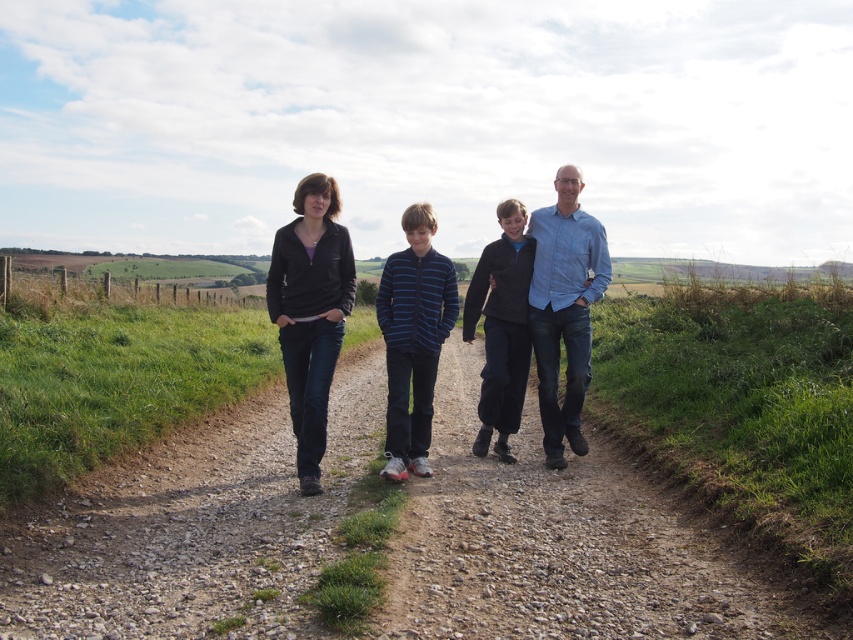
Which is above, blue striped sweater at center or dark blue fleece jacket at center?

dark blue fleece jacket at center is above.

Is point (426, 436) positioned before point (465, 326)?

Yes, point (426, 436) is closer to viewer.

Locate an element on the screen. The height and width of the screenshot is (640, 853). blue striped sweater at center is located at coordinates (413, 339).

The height and width of the screenshot is (640, 853). Describe the element at coordinates (413, 337) in the screenshot. I see `dark blue jeans at center` at that location.

Is dark blue jeans at center taller than dark blue fleece jacket at center?

No, dark blue jeans at center is not taller than dark blue fleece jacket at center.

The width and height of the screenshot is (853, 640). What are the coordinates of `dark blue jeans at center` in the screenshot? It's located at (413, 337).

I want to click on dark blue jeans at center, so click(x=413, y=337).

Which is in front, point (521, 342) or point (393, 472)?

Point (393, 472) is more forward.

Consider the image. Measure the distance between dark blue jeans at center and camera.

5.66 meters

What do you see at coordinates (413, 337) in the screenshot? The width and height of the screenshot is (853, 640). I see `dark blue jeans at center` at bounding box center [413, 337].

In order to click on dark blue jeans at center in this screenshot , I will do `click(413, 337)`.